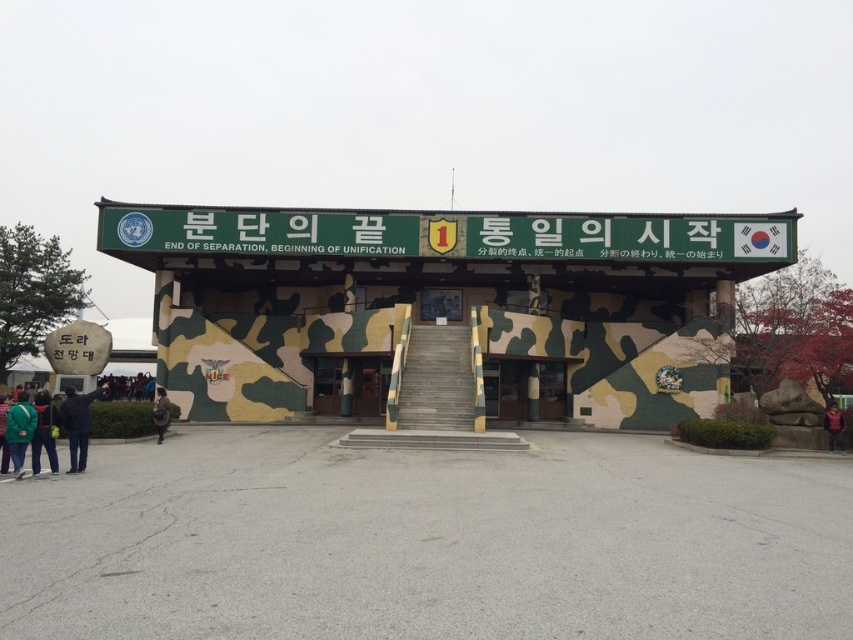
Does green camouflage door at center have a larger size compared to green matte jacket at lower left?

Indeed, green camouflage door at center has a larger size compared to green matte jacket at lower left.

Which of these two, green camouflage door at center or green matte jacket at lower left, stands taller?

With more height is green camouflage door at center.

Which is behind, point (497, 397) or point (36, 394)?

Positioned behind is point (497, 397).

Where is `green camouflage door at center`? green camouflage door at center is located at coordinates (524, 388).

Image resolution: width=853 pixels, height=640 pixels. Describe the element at coordinates (44, 433) in the screenshot. I see `green matte jacket at lower left` at that location.

Is point (39, 433) behind point (166, 410)?

No.

Where is `green matte jacket at lower left`? green matte jacket at lower left is located at coordinates (x=44, y=433).

Is green camouflage door at center smaller than camouflage jacket at lower left?

Correct, green camouflage door at center occupies less space than camouflage jacket at lower left.

Describe the element at coordinates (524, 388) in the screenshot. I see `green camouflage door at center` at that location.

You are a GUI agent. You are given a task and a screenshot of the screen. Output one action in this format:
    pyautogui.click(x=<x>, y=<y>)
    Task: Click on the green camouflage door at center
    This screenshot has width=853, height=640.
    Given the screenshot: What is the action you would take?
    pyautogui.click(x=524, y=388)